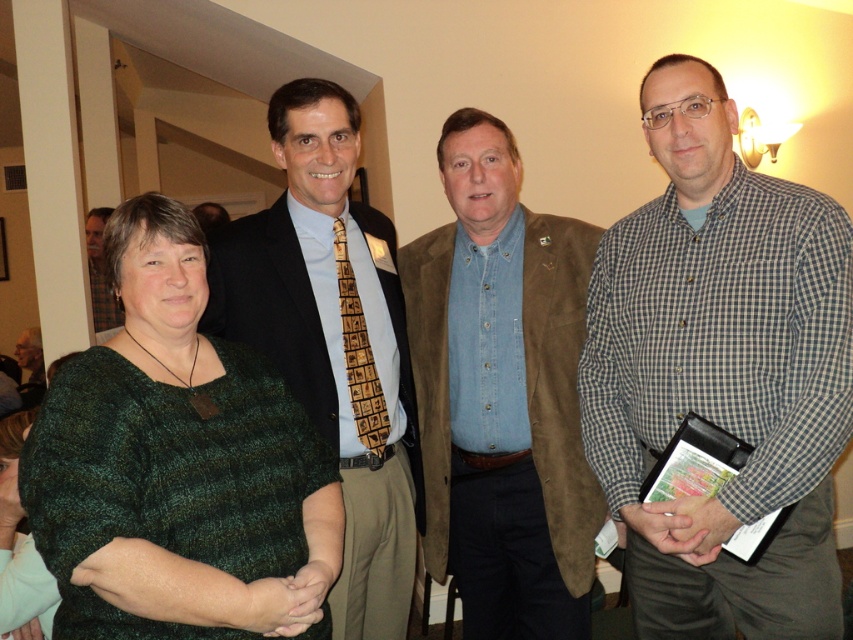
The width and height of the screenshot is (853, 640). I want to click on checkered fabric shirt at center, so click(x=721, y=371).

What do you see at coordinates (721, 371) in the screenshot? I see `checkered fabric shirt at center` at bounding box center [721, 371].

The height and width of the screenshot is (640, 853). I want to click on checkered fabric shirt at center, so click(x=721, y=371).

Is point (772, 260) in front of point (396, 413)?

Yes, it is.

Is point (641, 96) more distant than point (294, 349)?

No, it is in front of (294, 349).

Locate an element on the screen. checkered fabric shirt at center is located at coordinates (721, 371).

Does brown woven tie at center appear on the right side of green textured sweater at lower left?

Correct, you'll find brown woven tie at center to the right of green textured sweater at lower left.

In the scene shown: Is brown woven tie at center taller than green textured sweater at lower left?

No, brown woven tie at center is not taller than green textured sweater at lower left.

This screenshot has width=853, height=640. I want to click on brown woven tie at center, so click(x=358, y=355).